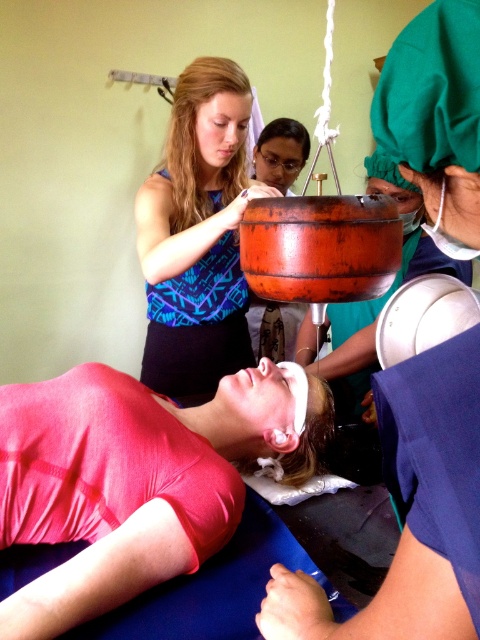
Which is more to the left, blue patterned tank top at upper center or rustic wooden pot at center?

blue patterned tank top at upper center is more to the left.

Is blue patterned tank top at upper center bigger than rustic wooden pot at center?

Correct, blue patterned tank top at upper center is larger in size than rustic wooden pot at center.

Which is behind, point (180, 102) or point (288, 317)?

Point (288, 317)

Locate an element on the screen. blue patterned tank top at upper center is located at coordinates (197, 234).

Locate an element on the screen. pink fabric at lower left is located at coordinates (137, 477).

This screenshot has height=640, width=480. Describe the element at coordinates (137, 477) in the screenshot. I see `pink fabric at lower left` at that location.

You are a GUI agent. You are given a task and a screenshot of the screen. Output one action in this format:
    pyautogui.click(x=<x>, y=<y>)
    Task: Click on the pink fabric at lower left
    This screenshot has width=480, height=640.
    Given the screenshot: What is the action you would take?
    pyautogui.click(x=137, y=477)

Does matte orange basin at center have a smaller size compared to blue patterned tank top at upper center?

Indeed, matte orange basin at center has a smaller size compared to blue patterned tank top at upper center.

Is matte orange basin at center positioned in front of blue patterned tank top at upper center?

Yes.

Does point (439, 634) come in front of point (201, 234)?

Yes, it is in front of point (201, 234).

At what (x,y) coordinates should I click in order to perform the action: click on matte orange basin at center. Please return your answer as a coordinate pair (x, y). Looking at the image, I should click on (410, 516).